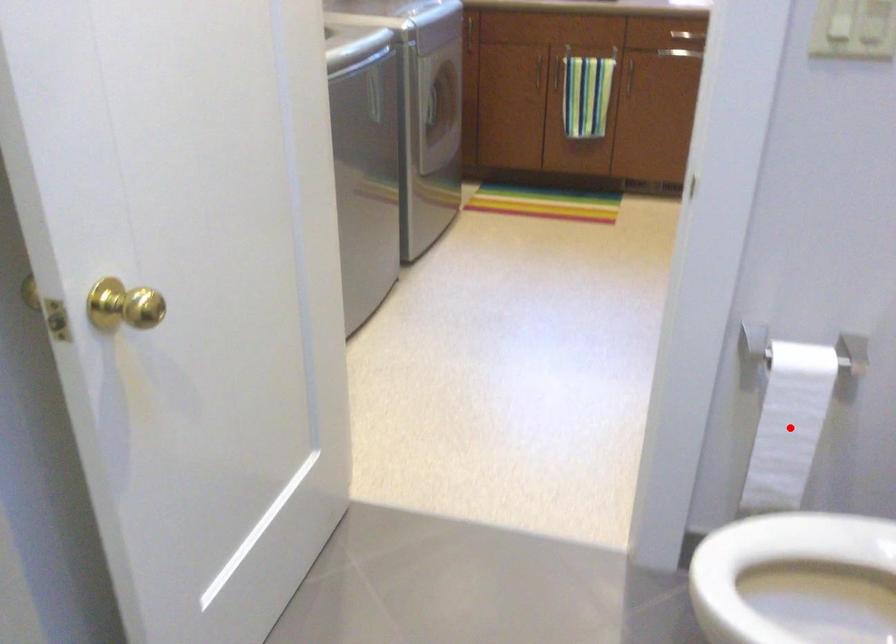
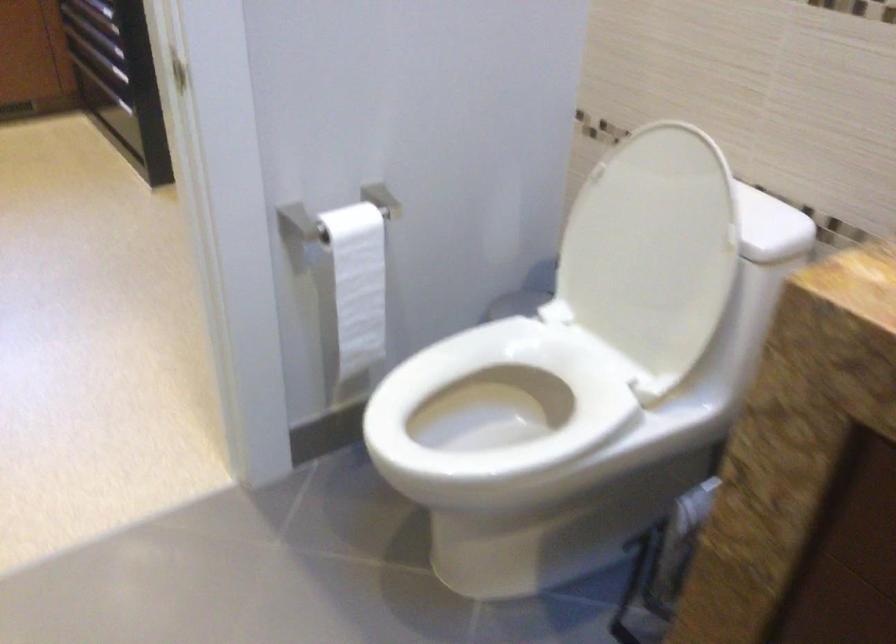
The point at the highlighted location is marked in the first image. Where is the corresponding point in the second image?

(357, 283)